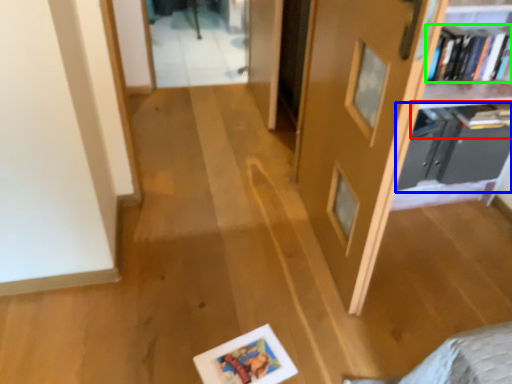
Question: Based on their relative distances, which object is nearer to book (highlighted by a red box)? Choose from shelf (highlighted by a blue box) and book (highlighted by a green box).

Choices:
 (A) shelf
 (B) book

Answer: (A)